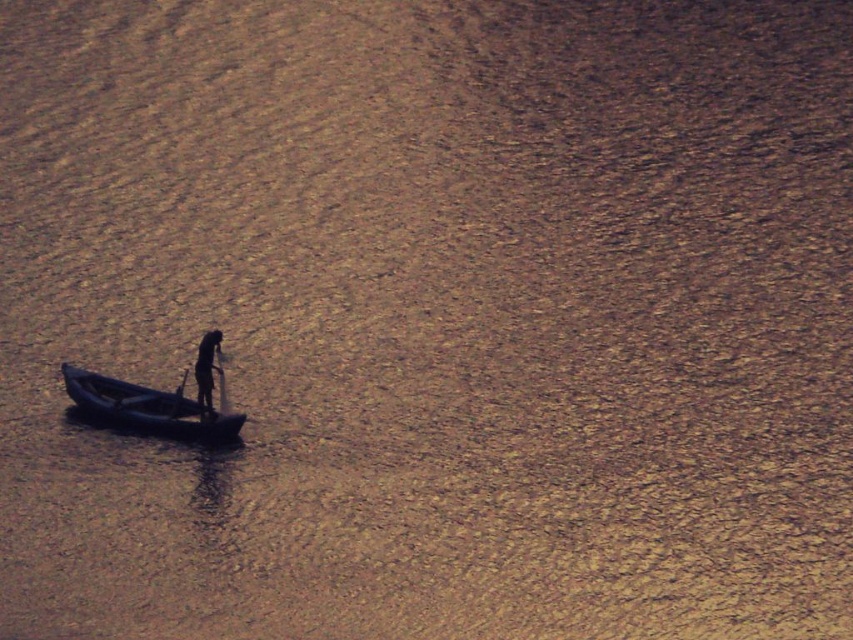
Can you confirm if black matte person at center is thinner than black plastic paddle at center?

No, black matte person at center is not thinner than black plastic paddle at center.

Which is above, black matte person at center or black plastic paddle at center?

black matte person at center is above.

Which is behind, point (202, 413) or point (181, 387)?

The point (181, 387) is behind.

Where is `black matte person at center`? The image size is (853, 640). black matte person at center is located at coordinates (206, 371).

From the picture: Does blue rubber canoe at center have a smaller size compared to black plastic paddle at center?

Incorrect, blue rubber canoe at center is not smaller in size than black plastic paddle at center.

The width and height of the screenshot is (853, 640). Identify the location of blue rubber canoe at center. point(148,406).

The image size is (853, 640). Identify the location of blue rubber canoe at center. (148, 406).

Does blue rubber canoe at center appear under black matte person at center?

Correct, blue rubber canoe at center is located below black matte person at center.

Image resolution: width=853 pixels, height=640 pixels. Describe the element at coordinates (148, 406) in the screenshot. I see `blue rubber canoe at center` at that location.

Identify the location of blue rubber canoe at center. (148, 406).